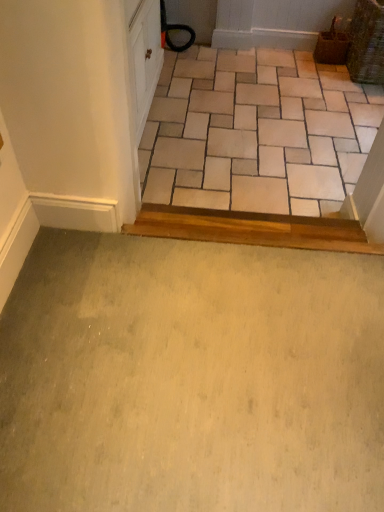
Where is `free location above green carpet at lower center (from a real-world perspective)`? Image resolution: width=384 pixels, height=512 pixels. free location above green carpet at lower center (from a real-world perspective) is located at coordinates (193, 351).